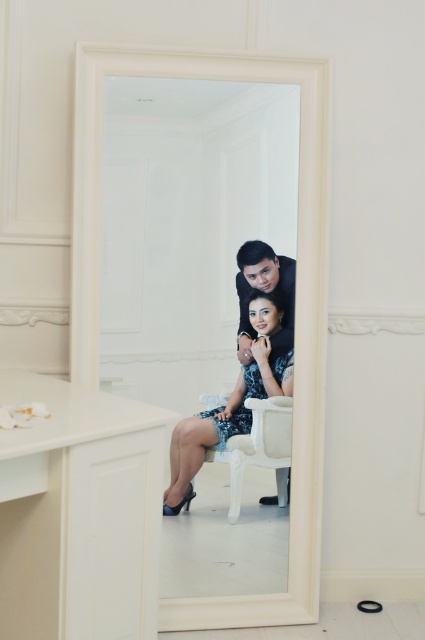
Does white glossy mirror at center appear on the left side of shiny blue dress at center?

Correct, you'll find white glossy mirror at center to the left of shiny blue dress at center.

Between point (84, 189) and point (164, 500), which one is positioned in front?

Point (84, 189) is more forward.

In order to click on white glossy mirror at center in this screenshot , I will do `click(295, 300)`.